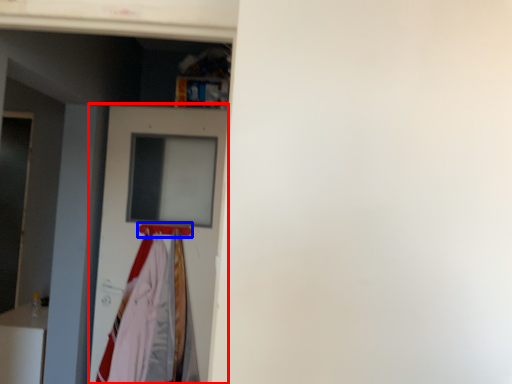
Question: Which object is closer to the camera taking this photo, door (highlighted by a red box) or hanger (highlighted by a blue box)?

Choices:
 (A) door
 (B) hanger

Answer: (A)